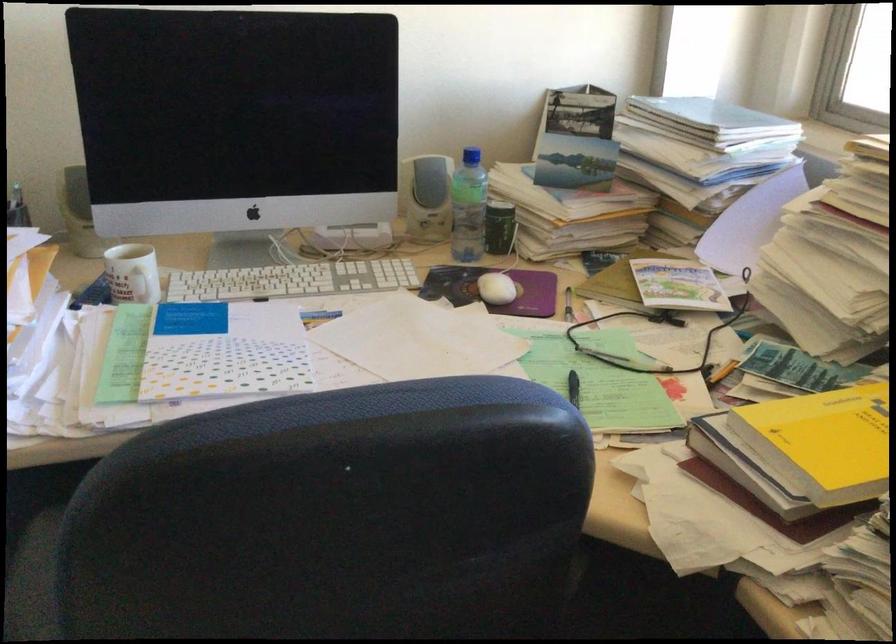
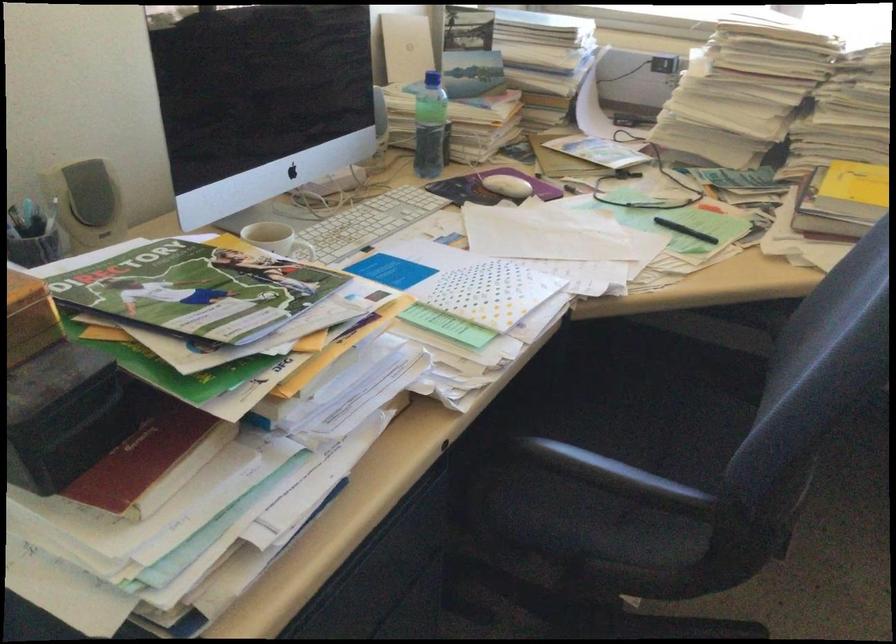
Find the pixel in the second image that matches point 588,398 in the first image.

(684, 230)